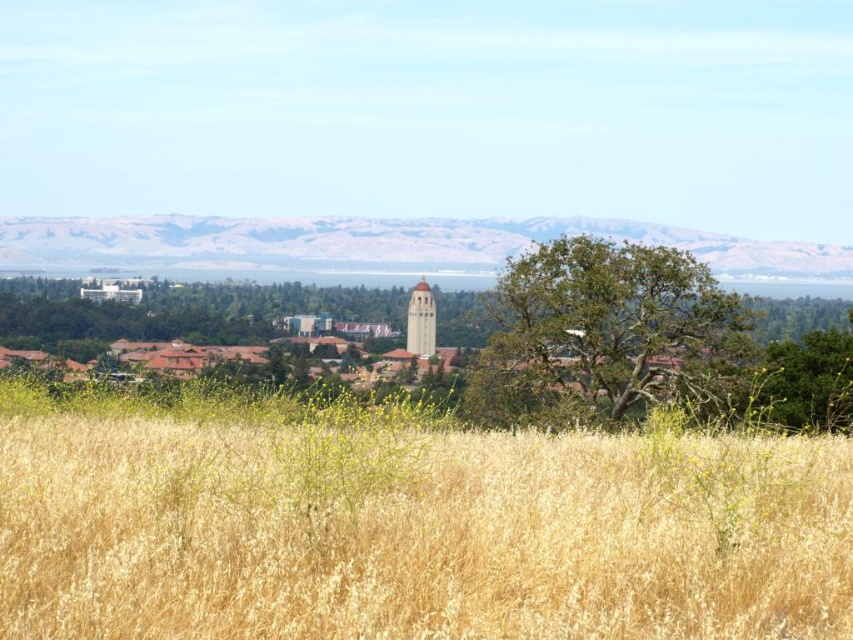
Question: Which point is closer to the camera taking this photo?

Choices:
 (A) (421, 301)
 (B) (77, 250)
 (C) (619, 381)
 (D) (699, 515)

Answer: (D)

Question: Is green rough bark tree at center thinner than smooth tan bell tower at center?

Choices:
 (A) no
 (B) yes

Answer: (A)

Question: Is dry grass at center behind smooth tan bell tower at center?

Choices:
 (A) yes
 (B) no

Answer: (B)

Question: Which of these objects is positioned farthest from the gray/rocky mountain at center?

Choices:
 (A) dry grass at center
 (B) smooth tan bell tower at center

Answer: (A)

Question: Where is green rough bark tree at center located in relation to gray/rocky mountain at center in the image?

Choices:
 (A) below
 (B) above

Answer: (A)

Question: Which point is farther to the camera?

Choices:
 (A) dry grass at center
 (B) green rough bark tree at center

Answer: (B)